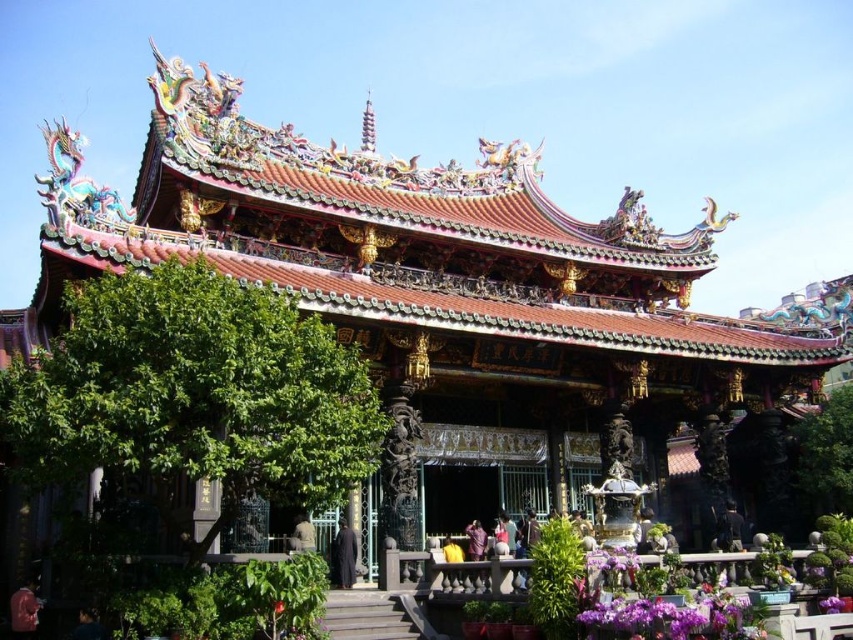
Question: Is green leafy tree at left smaller than green leafy tree at lower right?

Choices:
 (A) no
 (B) yes

Answer: (A)

Question: Which of the following is the closest to the observer?

Choices:
 (A) green leafy tree at left
 (B) green leafy tree at lower right

Answer: (A)

Question: Is green leafy tree at left below green leafy tree at lower right?

Choices:
 (A) yes
 (B) no

Answer: (B)

Question: Which object is farther from the camera taking this photo?

Choices:
 (A) green leafy tree at left
 (B) green leafy tree at lower right

Answer: (B)

Question: Is green leafy tree at left bigger than green leafy tree at lower right?

Choices:
 (A) yes
 (B) no

Answer: (A)